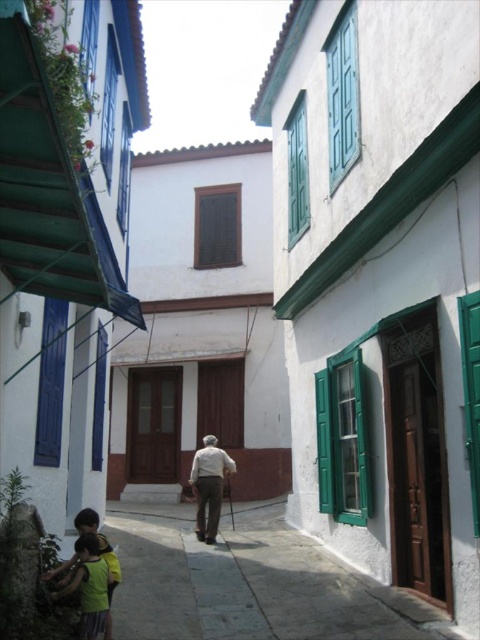
Which is more to the right, green painted wood at upper center or white matte shirt at center?

From the viewer's perspective, green painted wood at upper center appears more on the right side.

Measure the distance between point (345, 60) and camera.

Point (345, 60) and camera are 8.27 meters apart from each other.

Between point (328, 100) and point (192, 476), which one is positioned behind?

The point (192, 476) is behind.

The image size is (480, 640). Find the location of `green painted wood at upper center`. green painted wood at upper center is located at coordinates (343, 93).

Which is behind, point (309, 634) or point (212, 208)?

The point (212, 208) is behind.

Describe the element at coordinates (249, 582) in the screenshot. This screenshot has width=480, height=640. I see `smooth stone pavement at lower left` at that location.

Which is in front, point (304, 620) or point (223, 230)?

Positioned in front is point (304, 620).

Identify the location of smooth stone pavement at lower left. The width and height of the screenshot is (480, 640). (249, 582).

Which is below, yellow cotton shirt at lower left or white matte shirt at center?

Positioned lower is white matte shirt at center.

Consider the image. Can you confirm if yellow cotton shirt at lower left is bigger than white matte shirt at center?

Incorrect, yellow cotton shirt at lower left is not larger than white matte shirt at center.

Between point (95, 577) and point (204, 500), which one is positioned in front?

Point (95, 577) is in front.

You are a GUI agent. You are given a task and a screenshot of the screen. Output one action in this format:
    pyautogui.click(x=<x>, y=<y>)
    Task: Click on the yellow cotton shirt at lower left
    
    Given the screenshot: What is the action you would take?
    pyautogui.click(x=90, y=586)